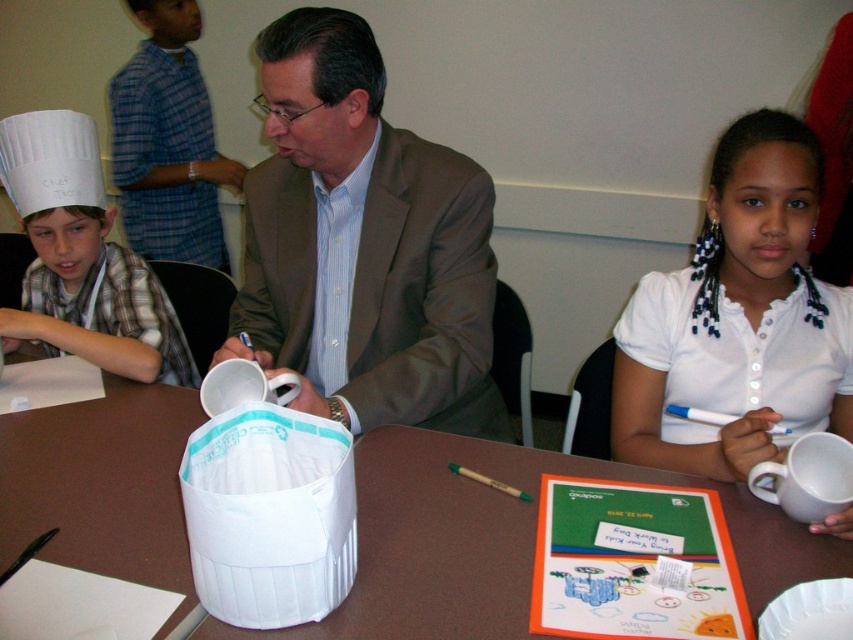
Can you confirm if white matte shirt at upper right is bigger than white paper chef hat at left?

No.

Is white matte shirt at upper right shorter than white paper chef hat at left?

In fact, white matte shirt at upper right may be taller than white paper chef hat at left.

Image resolution: width=853 pixels, height=640 pixels. What do you see at coordinates (737, 317) in the screenshot? I see `white matte shirt at upper right` at bounding box center [737, 317].

Find the location of a particular element. The width and height of the screenshot is (853, 640). white matte shirt at upper right is located at coordinates (737, 317).

Who is shorter, brown fabric suit at center or white paper chef hat at left?

white paper chef hat at left is shorter.

Is brown fabric suit at center positioned behind white paper chef hat at left?

No, it is not.

Does point (329, 184) come closer to viewer compared to point (38, 273)?

Yes, point (329, 184) is closer to viewer.

Image resolution: width=853 pixels, height=640 pixels. Find the location of `brown fabric suit at center`. brown fabric suit at center is located at coordinates (363, 244).

Which is behind, point (373, 378) or point (773, 611)?

The point (373, 378) is behind.

You are a GUI agent. You are given a task and a screenshot of the screen. Output one action in this format:
    pyautogui.click(x=<x>, y=<y>)
    Task: Click on the brown fabric suit at center
    The width and height of the screenshot is (853, 640).
    Given the screenshot: What is the action you would take?
    pyautogui.click(x=363, y=244)

The height and width of the screenshot is (640, 853). Identify the location of brown fabric suit at center. (363, 244).